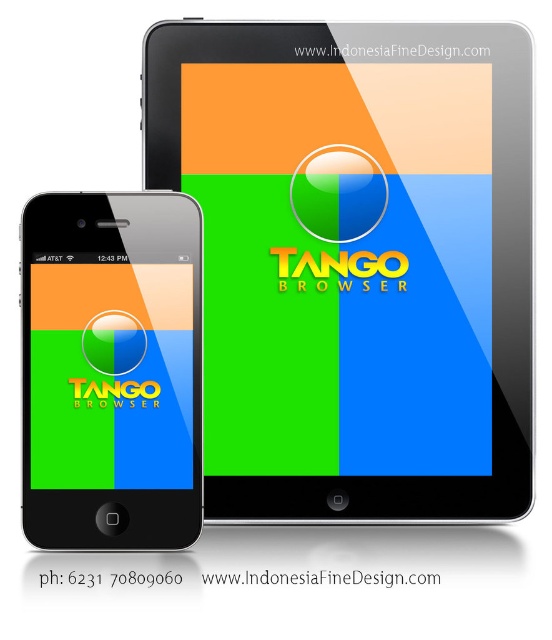
Which is more to the right, matte black tablet at center or green glossy sphere at lower left?

matte black tablet at center is more to the right.

Is matte black tablet at center positioned at the back of green glossy sphere at lower left?

That is True.

The image size is (552, 640). What are the coordinates of `matte black tablet at center` in the screenshot? It's located at (355, 264).

This screenshot has width=552, height=640. In order to click on matte black tablet at center in this screenshot , I will do tap(355, 264).

Does matte black smartphone at left have a greater height compared to green glossy sphere at lower left?

Yes, matte black smartphone at left is taller than green glossy sphere at lower left.

This screenshot has height=640, width=552. What do you see at coordinates (112, 371) in the screenshot? I see `matte black smartphone at left` at bounding box center [112, 371].

Find the location of a particular element. matte black smartphone at left is located at coordinates (112, 371).

Does matte black tablet at center appear on the left side of matte black smartphone at left?

In fact, matte black tablet at center is to the right of matte black smartphone at left.

Does matte black tablet at center have a larger size compared to matte black smartphone at left?

Indeed, matte black tablet at center has a larger size compared to matte black smartphone at left.

At what (x,y) coordinates should I click in order to perform the action: click on matte black tablet at center. Please return your answer as a coordinate pair (x, y). Image resolution: width=552 pixels, height=640 pixels. Looking at the image, I should click on (355, 264).